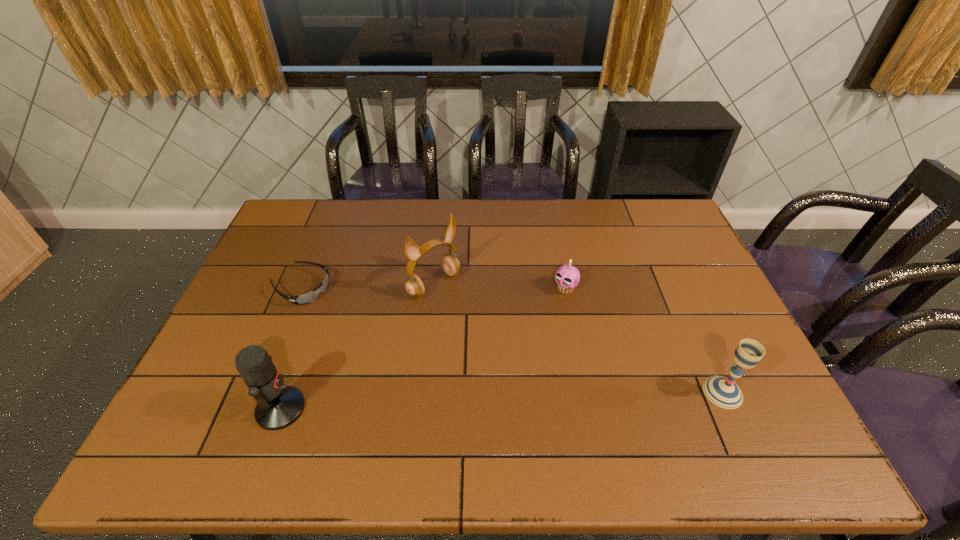
Locate an element on the screen. Image resolution: width=960 pixels, height=540 pixels. vacant space situated on the front-facing side of the third object from right to left is located at coordinates (463, 308).

Where is `free space located 0.180m on the front-facing side of the third object from right to left`? free space located 0.180m on the front-facing side of the third object from right to left is located at coordinates (491, 332).

Identify the location of free location located 0.320m on the face of the fourth object from left to right. This screenshot has height=540, width=960. (492, 362).

Identify the location of vacant space located 0.180m on the face of the fourth object from left to right. (524, 330).

The image size is (960, 540). In order to click on vacant region located 0.120m on the face of the fourth object from left to right in this screenshot , I will do `click(537, 318)`.

Identify the location of free point located on the lenses of the shortest object. (375, 326).

The image size is (960, 540). I want to click on vacant region located 0.090m on the lenses of the shortest object, so click(345, 310).

At what (x,y) coordinates should I click in order to perform the action: click on vacant area located 0.330m on the lenses of the shortest object. Please return your answer as a coordinate pair (x, y). The image size is (960, 540). Looking at the image, I should click on (409, 343).

Image resolution: width=960 pixels, height=540 pixels. Find the location of `microphone at the near edge`. microphone at the near edge is located at coordinates (278, 406).

Where is `chalice that is at the near edge`? Image resolution: width=960 pixels, height=540 pixels. chalice that is at the near edge is located at coordinates (724, 392).